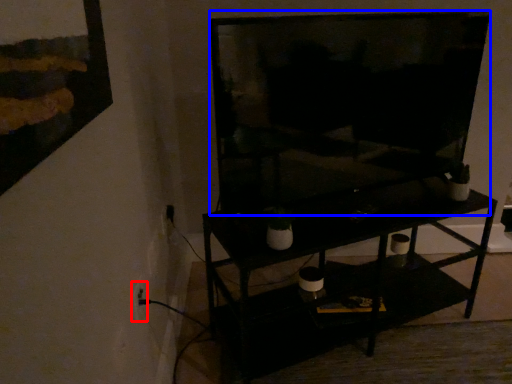
Question: Which of the following is the farthest to the observer, electric outlet (highlighted by a red box) or television (highlighted by a blue box)?

Choices:
 (A) electric outlet
 (B) television

Answer: (A)